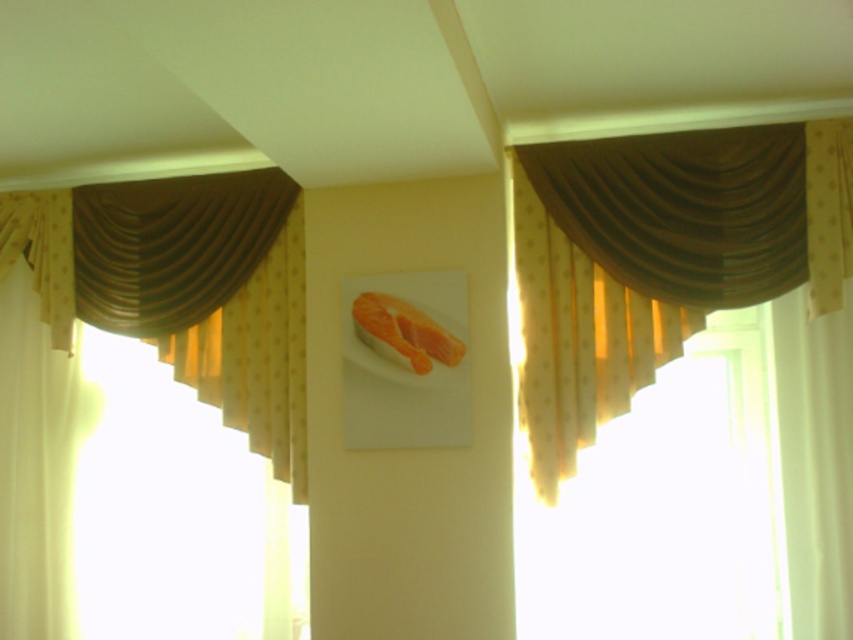
From the picture: Can you confirm if brown sheer curtain at upper right is bigger than brown satin curtain at upper left?

No.

Is brown sheer curtain at upper right below brown satin curtain at upper left?

No, brown sheer curtain at upper right is not below brown satin curtain at upper left.

This screenshot has width=853, height=640. Identify the location of brown sheer curtain at upper right. (660, 257).